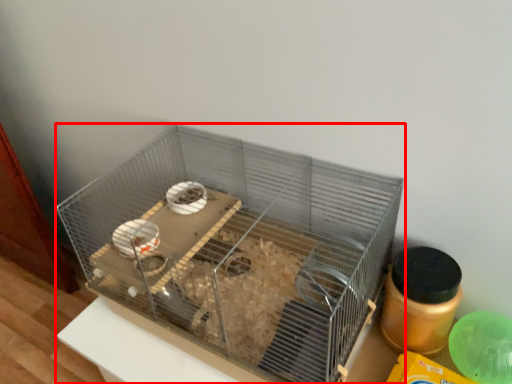
Question: From the image's perspective, where is bird cage (annotated by the red box) located in relation to bottle in the image?

Choices:
 (A) above
 (B) below

Answer: (A)